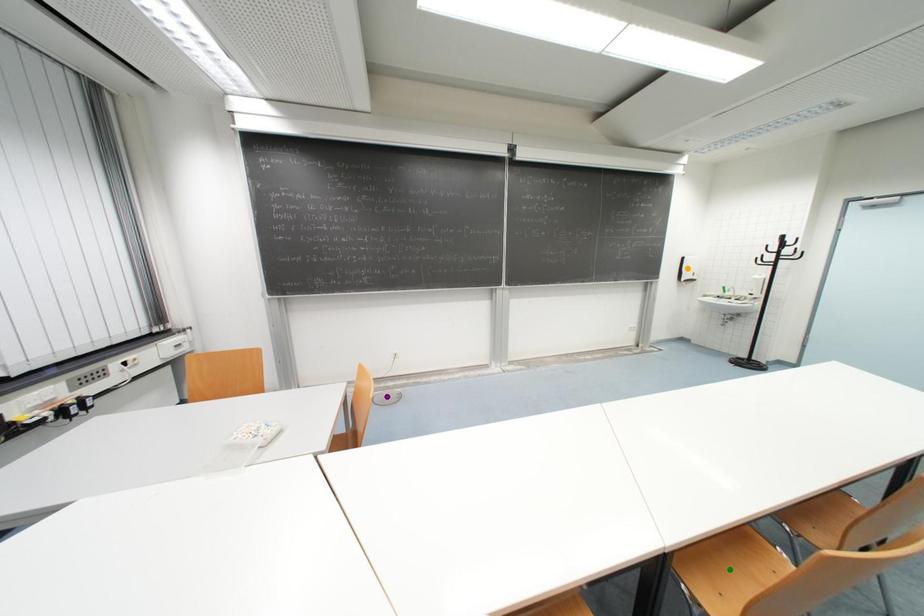
Order these from nearest to farthest:
orange point
purple point
green point

1. green point
2. purple point
3. orange point